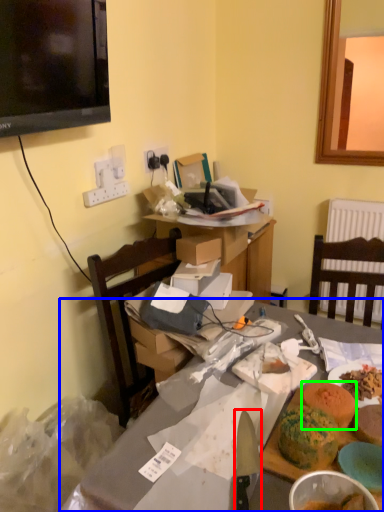
Question: Which is farther away from knife (highlighted by a red box)? table (highlighted by a blue box) or food (highlighted by a green box)?

Choices:
 (A) table
 (B) food

Answer: (A)